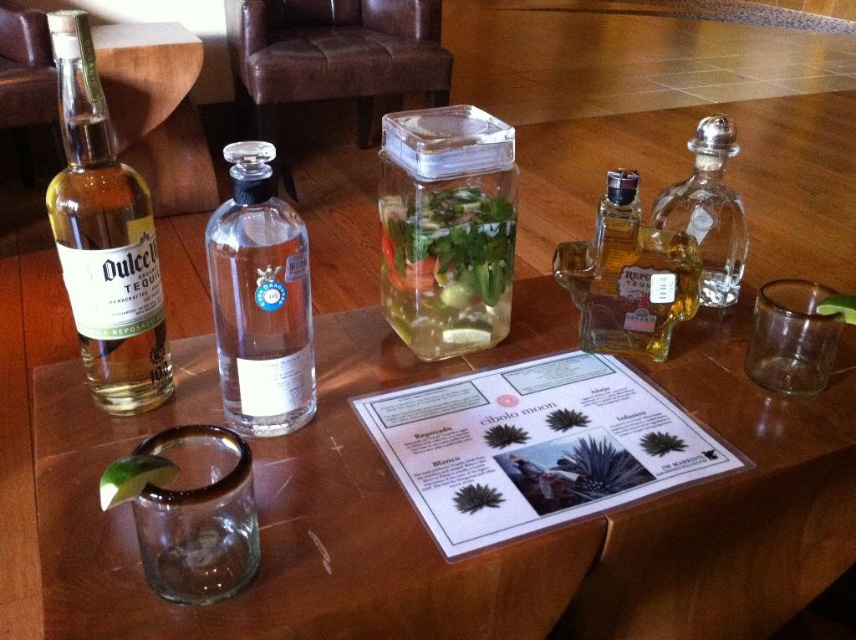
Does translucent glass tequila bottle at left appear on the right side of clear glass bottle at center?

No, translucent glass tequila bottle at left is not to the right of clear glass bottle at center.

Is translucent glass tequila bottle at left below clear glass bottle at center?

Yes, translucent glass tequila bottle at left is below clear glass bottle at center.

Does point (57, 68) come closer to viewer compared to point (227, 344)?

No, (57, 68) is behind (227, 344).

You are a GUI agent. You are given a task and a screenshot of the screen. Output one action in this format:
    pyautogui.click(x=<x>, y=<y>)
    Task: Click on the translucent glass tequila bottle at left
    
    Given the screenshot: What is the action you would take?
    pyautogui.click(x=104, y=237)

Is translucent glass tequila bottle at center-right shorter than clear glass bottle at upper right?

Yes.

Does translucent glass tequila bottle at center-right appear on the left side of clear glass bottle at upper right?

Indeed, translucent glass tequila bottle at center-right is positioned on the left side of clear glass bottle at upper right.

Does point (658, 346) lie behind point (673, 227)?

No, (658, 346) is in front of (673, 227).

Identify the location of translucent glass tequila bottle at center-right. (628, 276).

Is the position of clear glass menu at center more distant than that of clear glass container at center?

That is False.

The image size is (856, 640). What do you see at coordinates (420, 524) in the screenshot? I see `clear glass menu at center` at bounding box center [420, 524].

Locate an element on the screen. The height and width of the screenshot is (640, 856). clear glass menu at center is located at coordinates (420, 524).